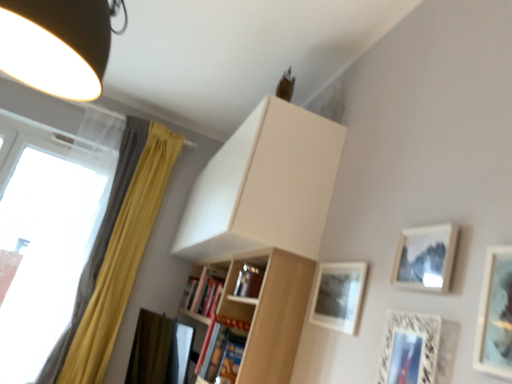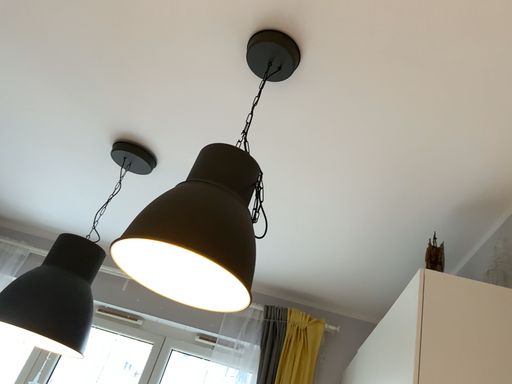
Question: Which way did the camera rotate in the video?

Choices:
 (A) rotated upward
 (B) rotated downward

Answer: (A)